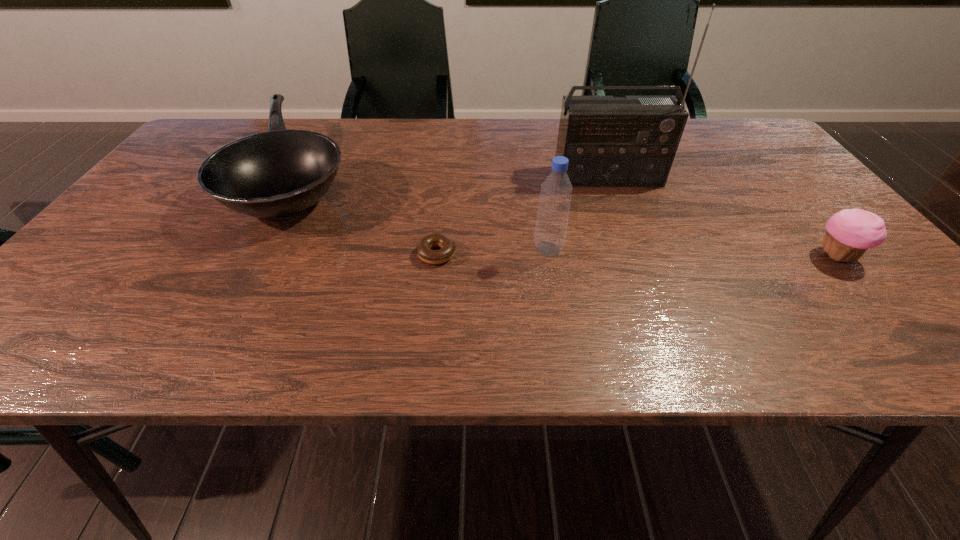
You are a GUI agent. You are given a task and a screenshot of the screen. Output one action in this format:
    pyautogui.click(x=<x>, y=<y>)
    Task: Click on the vacant space at the far right corner of the desktop
    This screenshot has width=960, height=540.
    Given the screenshot: What is the action you would take?
    pyautogui.click(x=734, y=154)

Find the location of a particular element. The width and height of the screenshot is (960, 540). vacant space in between the fourth shortest object and the shortest object is located at coordinates (492, 252).

Identify the location of vacant region between the tallest object and the second tallest object. (578, 213).

Identify the location of free space between the rightmost object and the shortest object. (636, 255).

What are the coordinates of `vacant region between the leftmost object and the radio receiver` in the screenshot? It's located at (453, 177).

The image size is (960, 540). Find the location of `vacant area that lies between the shortest object and the leftmost object`. vacant area that lies between the shortest object and the leftmost object is located at coordinates (368, 216).

Where is `empty space that is in between the fourth object from right to left and the fourth object from left to right`? empty space that is in between the fourth object from right to left and the fourth object from left to right is located at coordinates (522, 215).

The image size is (960, 540). I want to click on free spot between the leftmost object and the shortest object, so click(x=368, y=216).

At what (x,y) coordinates should I click in order to perform the action: click on empty space that is in between the frying pan and the doughnut. Please return your answer as a coordinate pair (x, y). Image resolution: width=960 pixels, height=540 pixels. Looking at the image, I should click on (368, 216).

At what (x,y) coordinates should I click in order to perform the action: click on object that is the second closest to the cupcake. Please return your answer as a coordinate pair (x, y). Looking at the image, I should click on (556, 191).